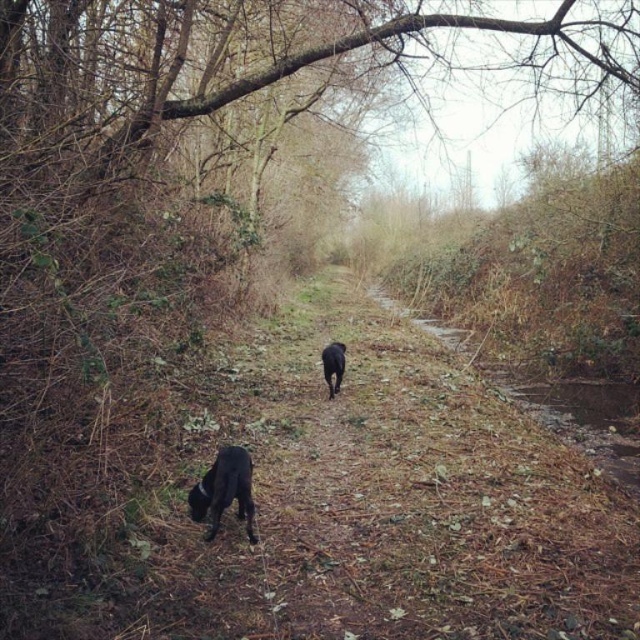
Does black matte dog at lower left have a smaller size compared to black matte dog at center?

Yes.

Is black matte dog at lower left shorter than black matte dog at center?

Indeed, black matte dog at lower left has a lesser height compared to black matte dog at center.

Identify the location of black matte dog at lower left. (225, 490).